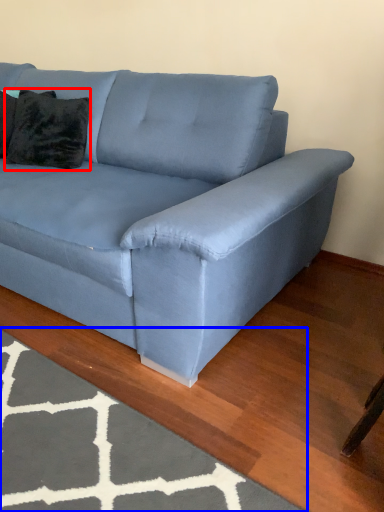
Question: Which point is closer to the camera, pillow (highlighted by a red box) or mat (highlighted by a blue box)?

Choices:
 (A) pillow
 (B) mat

Answer: (B)